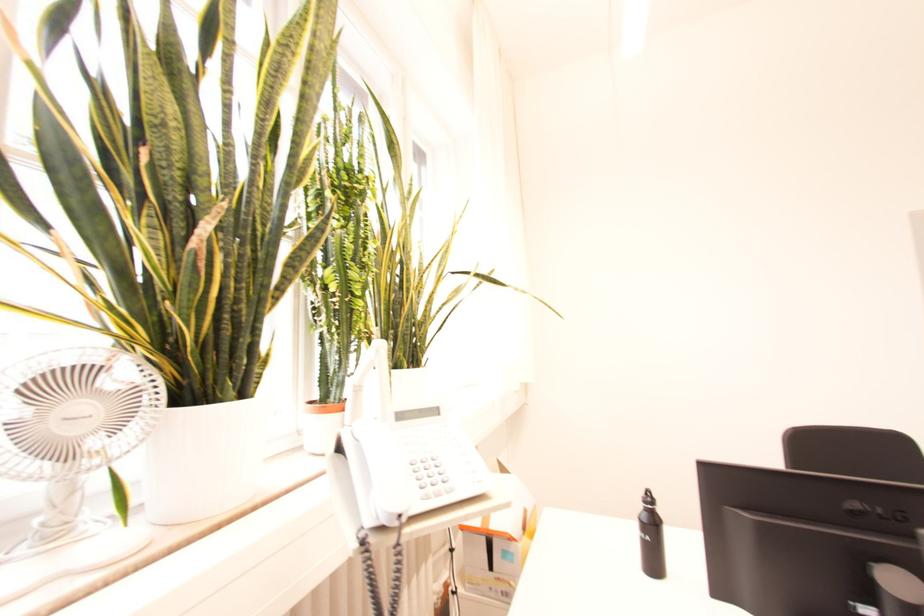
This screenshot has height=616, width=924. Find the location of `white telephone handset`. white telephone handset is located at coordinates (422, 461).